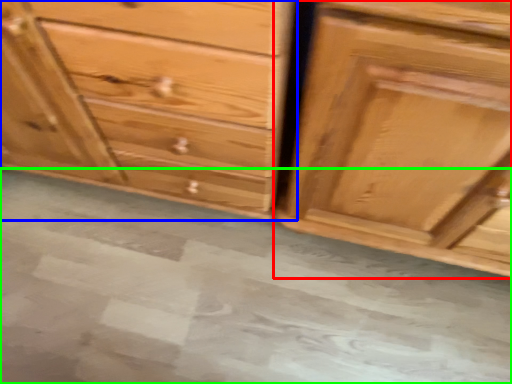
Question: Which object is positioned farthest from chest of drawers (highlighted by a red box)? Select from chest of drawers (highlighted by a blue box) and concrete (highlighted by a green box).

Choices:
 (A) chest of drawers
 (B) concrete

Answer: (B)